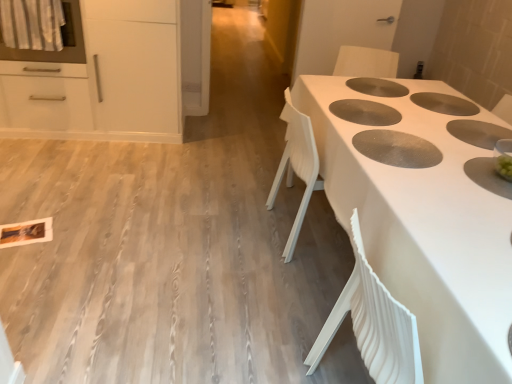
Where is `free space in front of white matte cabinet at upper left`? Image resolution: width=512 pixels, height=384 pixels. free space in front of white matte cabinet at upper left is located at coordinates (84, 170).